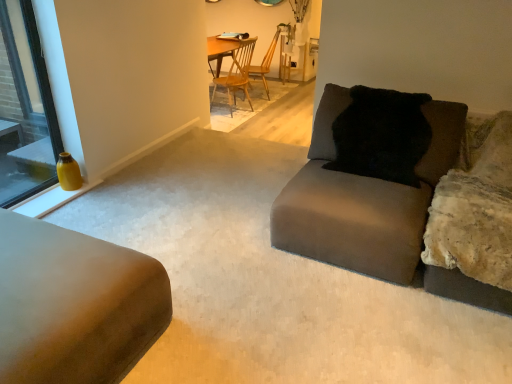
The height and width of the screenshot is (384, 512). What do you see at coordinates (375, 211) in the screenshot? I see `matte gray couch at center, the 2th studio couch positioned from the left` at bounding box center [375, 211].

Where is `suede-like beige couch at lower left, which is the 1th studio couch from left to right`? The height and width of the screenshot is (384, 512). suede-like beige couch at lower left, which is the 1th studio couch from left to right is located at coordinates (74, 304).

I want to click on black fuzzy pillow at upper right, so click(381, 135).

Identify the location of matte gray couch at center, acting as the 1th studio couch starting from the right. point(375,211).

Is wooden at center, arranged as the second chair when viewed from the back, oriented towards matte yellow vase at left?

No, wooden at center, arranged as the second chair when viewed from the back, does not turn towards matte yellow vase at left.

Which object is further away from the camera taking this photo, wooden at center, arranged as the second chair when viewed from the back, or matte yellow vase at left?

wooden at center, arranged as the second chair when viewed from the back, is behind.

Find the location of a particular element. The image size is (512, 384). the 1st chair positioned above the matte yellow vase at left (from the image's perspective) is located at coordinates tap(237, 74).

Considering the relative positions of wooden at center, arranged as the second chair when viewed from the back, and matte yellow vase at left in the image provided, is wooden at center, arranged as the second chair when viewed from the back, to the left or to the right of matte yellow vase at left?

Based on their positions, wooden at center, arranged as the second chair when viewed from the back, is located to the right of matte yellow vase at left.

Can you confirm if matte gray couch at center, the 2th studio couch positioned from the left, is thinner than wooden at center, arranged as the second chair when viewed from the back?

Incorrect, the width of matte gray couch at center, the 2th studio couch positioned from the left, is not less than that of wooden at center, arranged as the second chair when viewed from the back.

Considering the sizes of objects matte gray couch at center, the 2th studio couch positioned from the left, and wooden at center, arranged as the second chair when viewed from the back, in the image provided, who is shorter, matte gray couch at center, the 2th studio couch positioned from the left, or wooden at center, arranged as the second chair when viewed from the back,?

matte gray couch at center, the 2th studio couch positioned from the left, is shorter.

Could you tell me if matte gray couch at center, acting as the 1th studio couch starting from the right, is facing wooden at center, arranged as the second chair when viewed from the back?

No, matte gray couch at center, acting as the 1th studio couch starting from the right, is not oriented towards wooden at center, arranged as the second chair when viewed from the back.

Is wooden chair at center, which appears as the first chair when viewed from the back, outside of wooden at center, arranged as the second chair when viewed from the back?

wooden chair at center, which appears as the first chair when viewed from the back, lies outside wooden at center, arranged as the second chair when viewed from the back,'s area.

Is wooden chair at center, the second chair from the front, next to wooden at center, placed as the first chair when sorted from front to back?

No, wooden chair at center, the second chair from the front, is not beside wooden at center, placed as the first chair when sorted from front to back.

Is wooden chair at center, which appears as the first chair when viewed from the back, oriented towards wooden at center, placed as the first chair when sorted from front to back?

No.

Considering the relative sizes of wooden chair at center, the second chair from the front, and wooden at center, placed as the first chair when sorted from front to back, in the image provided, is wooden chair at center, the second chair from the front, wider than wooden at center, placed as the first chair when sorted from front to back,?

No.

From the image's perspective, which object appears higher, suede-like beige couch at lower left, which is counted as the 2th studio couch, starting from the right, or wooden at center, placed as the first chair when sorted from front to back?

wooden at center, placed as the first chair when sorted from front to back, from the image's perspective.

Is suede-like beige couch at lower left, which is counted as the 2th studio couch, starting from the right, turned away from wooden at center, arranged as the second chair when viewed from the back?

No, suede-like beige couch at lower left, which is counted as the 2th studio couch, starting from the right, is not facing the opposite direction of wooden at center, arranged as the second chair when viewed from the back.

Can wooden at center, arranged as the second chair when viewed from the back, be found inside suede-like beige couch at lower left, which is counted as the 2th studio couch, starting from the right?

That's incorrect, wooden at center, arranged as the second chair when viewed from the back, is not inside suede-like beige couch at lower left, which is counted as the 2th studio couch, starting from the right.

Considering the sizes of objects suede-like beige couch at lower left, which is counted as the 2th studio couch, starting from the right, and wooden at center, placed as the first chair when sorted from front to back, in the image provided, who is bigger, suede-like beige couch at lower left, which is counted as the 2th studio couch, starting from the right, or wooden at center, placed as the first chair when sorted from front to back,?

suede-like beige couch at lower left, which is counted as the 2th studio couch, starting from the right, is bigger.

Are matte gray couch at center, the 2th studio couch positioned from the left, and wooden chair at center, the second chair from the front, making contact?

matte gray couch at center, the 2th studio couch positioned from the left, and wooden chair at center, the second chair from the front, are not in contact.

Is matte gray couch at center, the 2th studio couch positioned from the left, positioned beyond the bounds of wooden chair at center, the second chair from the front?

matte gray couch at center, the 2th studio couch positioned from the left, is positioned outside wooden chair at center, the second chair from the front.

From the picture: Which object is positioned more to the left, matte gray couch at center, acting as the 1th studio couch starting from the right, or wooden chair at center, which appears as the first chair when viewed from the back?

wooden chair at center, which appears as the first chair when viewed from the back, is more to the left.

In the scene shown: Can you confirm if wooden chair at center, which appears as the first chair when viewed from the back, is wider than matte yellow vase at left?

Indeed, wooden chair at center, which appears as the first chair when viewed from the back, has a greater width compared to matte yellow vase at left.

Does wooden chair at center, the second chair from the front, have a greater height compared to matte yellow vase at left?

No, wooden chair at center, the second chair from the front, is not taller than matte yellow vase at left.

Could wooden at center, placed as the first chair when sorted from front to back, be considered to be inside black fuzzy pillow at upper right?

No.

Between point (358, 108) and point (233, 53), which one is positioned in front?

Positioned in front is point (358, 108).

Is black fuzzy pillow at upper right positioned far away from wooden at center, placed as the first chair when sorted from front to back?

Yes, black fuzzy pillow at upper right and wooden at center, placed as the first chair when sorted from front to back, are quite far apart.

What's the angular difference between black fuzzy pillow at upper right and wooden at center, placed as the first chair when sorted from front to back,'s facing directions?

black fuzzy pillow at upper right and wooden at center, placed as the first chair when sorted from front to back, are facing 107 degrees away from each other.

Which chair is the 1st one when counting from the right side of the matte yellow vase at left? Please provide its 2D coordinates.

[(237, 74)]

The width and height of the screenshot is (512, 384). There is a wooden at center, placed as the first chair when sorted from front to back. Find the location of `the 1st studio couch below it (from the image's perspective)`. the 1st studio couch below it (from the image's perspective) is located at coordinates (375, 211).

When comparing their distances from black fuzzy pillow at upper right, does wooden chair at center, which appears as the first chair when viewed from the back, or matte gray couch at center, the 2th studio couch positioned from the left, seem further?

wooden chair at center, which appears as the first chair when viewed from the back, is further to black fuzzy pillow at upper right.

From the picture: Considering their positions, is black fuzzy pillow at upper right positioned further to suede-like beige couch at lower left, which is counted as the 2th studio couch, starting from the right, than matte gray couch at center, acting as the 1th studio couch starting from the right?

Based on the image, black fuzzy pillow at upper right appears to be further to suede-like beige couch at lower left, which is counted as the 2th studio couch, starting from the right.

Consider the image. Looking at the image, which one is located further to black fuzzy pillow at upper right, matte gray couch at center, the 2th studio couch positioned from the left, or wooden chair at center, the second chair from the front?

wooden chair at center, the second chair from the front, is further to black fuzzy pillow at upper right.

Which object lies further to the anchor point wooden chair at center, which appears as the first chair when viewed from the back, matte yellow vase at left or black fuzzy pillow at upper right?

black fuzzy pillow at upper right lies further to wooden chair at center, which appears as the first chair when viewed from the back, than the other object.

Considering their positions, is suede-like beige couch at lower left, which is counted as the 2th studio couch, starting from the right, positioned further to wooden chair at center, the second chair from the front, than black fuzzy pillow at upper right?

Among the two, suede-like beige couch at lower left, which is counted as the 2th studio couch, starting from the right, is located further to wooden chair at center, the second chair from the front.

From the picture: Which object lies nearer to the anchor point black fuzzy pillow at upper right, matte gray couch at center, the 2th studio couch positioned from the left, or matte yellow vase at left?

Among the two, matte gray couch at center, the 2th studio couch positioned from the left, is located nearer to black fuzzy pillow at upper right.

When comparing their distances from wooden chair at center, the second chair from the front, does matte gray couch at center, the 2th studio couch positioned from the left, or wooden at center, arranged as the second chair when viewed from the back, seem closer?

The object closer to wooden chair at center, the second chair from the front, is wooden at center, arranged as the second chair when viewed from the back.

Based on their spatial positions, is matte gray couch at center, the 2th studio couch positioned from the left, or wooden chair at center, the second chair from the front, further from suede-like beige couch at lower left, which is counted as the 2th studio couch, starting from the right?

The object further to suede-like beige couch at lower left, which is counted as the 2th studio couch, starting from the right, is wooden chair at center, the second chair from the front.

What are the coordinates of `chair between suede-like beige couch at lower left, which is the 1th studio couch from left to right, and wooden chair at center, the second chair from the front, along the z-axis` in the screenshot? It's located at 237,74.

At what (x,y) coordinates should I click in order to perform the action: click on pillow between matte yellow vase at left and wooden at center, placed as the first chair when sorted from front to back, in the front-back direction. Please return your answer as a coordinate pair (x, y). This screenshot has width=512, height=384. Looking at the image, I should click on (381, 135).

Identify the location of pillow between suede-like beige couch at lower left, which is the 1th studio couch from left to right, and wooden chair at center, the second chair from the front, along the z-axis. The width and height of the screenshot is (512, 384). (381, 135).

Identify the location of window positioned between suede-like beige couch at lower left, which is the 1th studio couch from left to right, and wooden chair at center, the second chair from the front, from near to far. (25, 108).